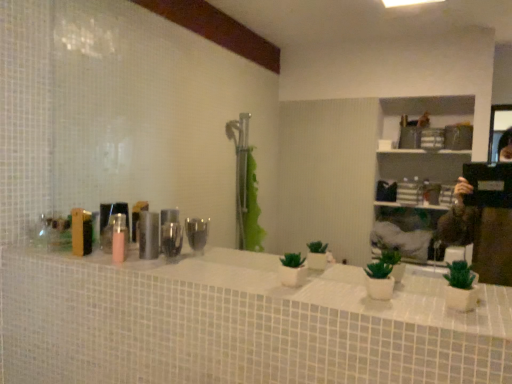
This screenshot has height=384, width=512. I want to click on vacant area located to the right-hand side of metallic cylindrical container at center, which is the first toiletry in right-to-left order, so click(x=205, y=263).